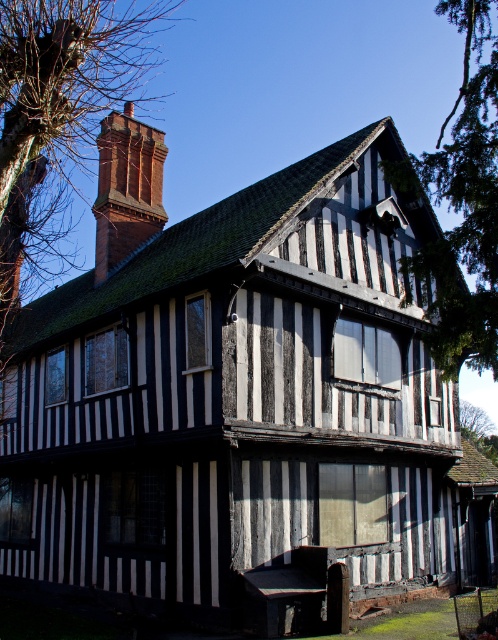
Find the location of a particular element. The width and height of the screenshot is (498, 640). green leafy tree at upper right is located at coordinates (462, 204).

Is point (444, 320) closer to viewer compared to point (126, 132)?

Yes, it is in front of point (126, 132).

The image size is (498, 640). In order to click on green leafy tree at upper right in this screenshot , I will do `click(462, 204)`.